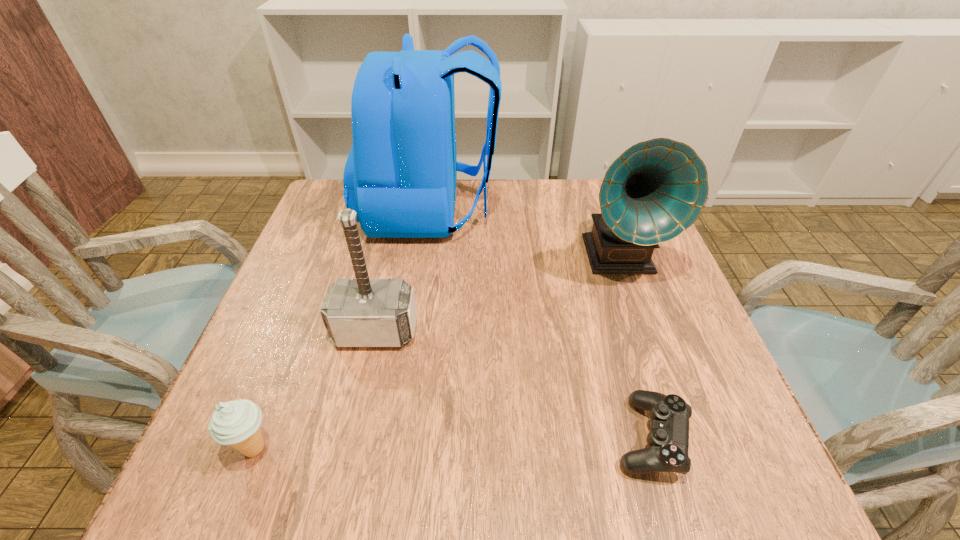
Where is `free location that satisfies the following two spatial constraints: 1. on the back of the backpack; 2. for striking with the head of the hammer`? The image size is (960, 540). free location that satisfies the following two spatial constraints: 1. on the back of the backpack; 2. for striking with the head of the hammer is located at coordinates (412, 331).

Where is `vacant area that satisfies the following two spatial constraints: 1. on the back of the backpack; 2. on the front side of the leftmost object`? The width and height of the screenshot is (960, 540). vacant area that satisfies the following two spatial constraints: 1. on the back of the backpack; 2. on the front side of the leftmost object is located at coordinates (395, 448).

Find the location of `vacant point that satisfies the following two spatial constraints: 1. on the back of the tallest object; 2. on the right side of the shortest object`. vacant point that satisfies the following two spatial constraints: 1. on the back of the tallest object; 2. on the right side of the shortest object is located at coordinates (396, 437).

What are the coordinates of `free region that satisfies the following two spatial constraints: 1. for striking with the head of the control; 2. on the right side of the hammer` in the screenshot? It's located at (352, 437).